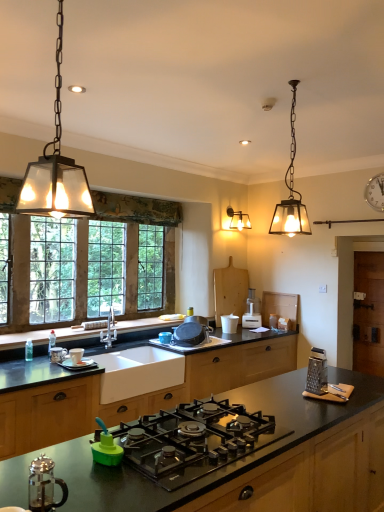
In order to click on vacant space situated above white plastic cup at center, the 4th appliance in the left-to-right sequence (from a real-world perspective) in this screenshot , I will do `click(227, 316)`.